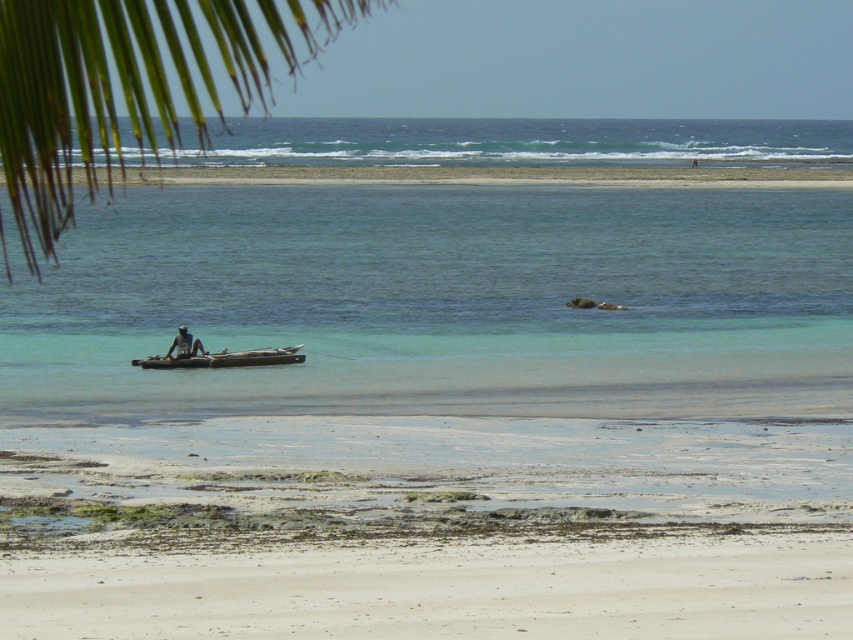
You are standing at the point with coordinates (440,589) in the coastal scene. What is the terrain like at your current location?

The point at coordinates (440,589) corresponds to the white sandy beach at lower center, which has light beige sand and patches of seaweed scattered across its surface.

You are standing at the point marked by the coordinates point (440, 589) in the image. Looking around, what is the immediate terrain you are standing on?

The point (440, 589) marks white sandy beach at lower center, so you are standing on a white sandy beach.